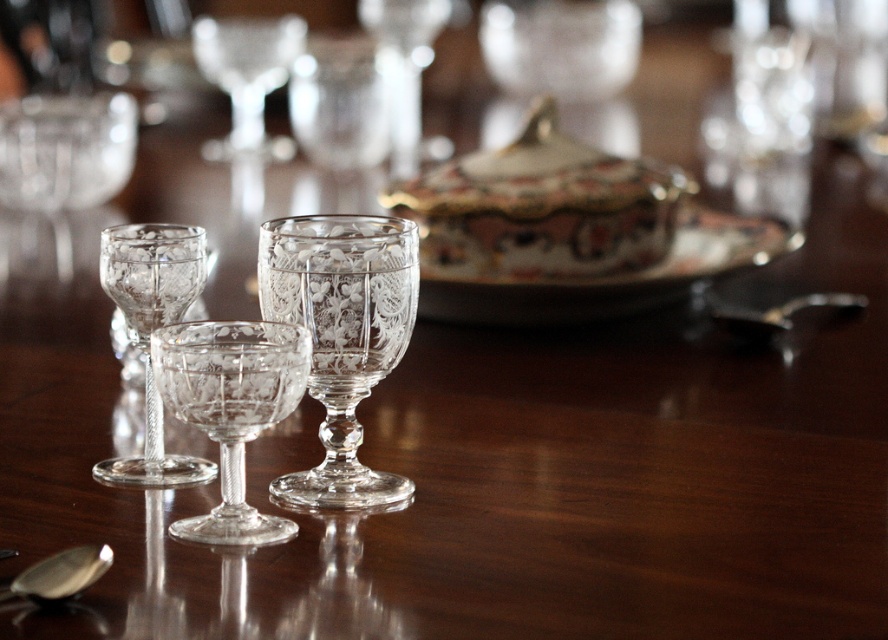
You are standing at the edge of the table and want to place a small ornament exactly at the point marked as point (x=341, y=336). Which object will the ornament be placed on?

The ornament will be placed on the clear crystal goblet at center because point (x=341, y=336) is on it.

You are arranging a dinner setting and need to place a napkin between the clear crystal goblet at center and the clear crystal wine glass at left. Given that the napkin is 9 centimeters wide, will it fit snugly between them?

The distance between the clear crystal goblet at center and the clear crystal wine glass at left is 8.99 centimeters. Since the napkin is 9 centimeters wide, it will be slightly too wide to fit snugly between them.

Based on the photo, you are arranging a formal dinner setting and need to place the polished silver spoon at lower right. Where should you position it relative to the clear crystal wine glass at center?

The polished silver spoon at lower right should be placed below the clear crystal wine glass at center since the clear crystal wine glass at center is located above it.